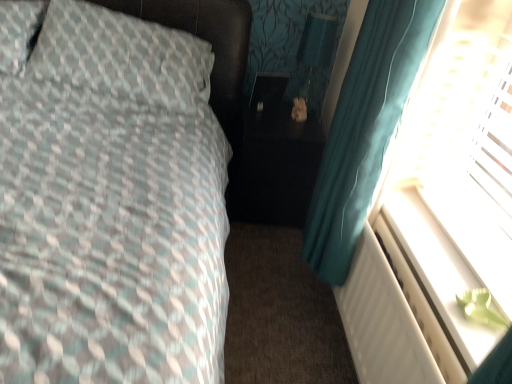
At what (x,y) coordinates should I click in order to perform the action: click on empty space that is ontop of black glossy side table at center. Please return your answer as a coordinate pair (x, y). The image size is (512, 384). Looking at the image, I should click on (276, 117).